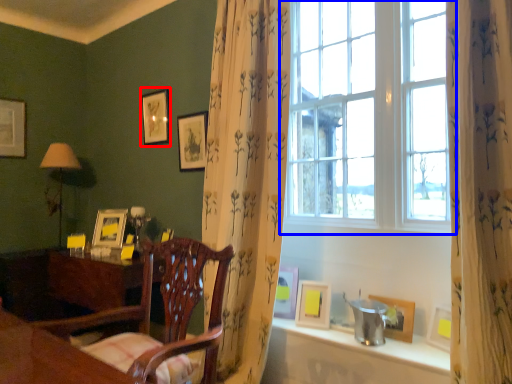
Question: Which object appears closest to the camera in this image, picture frame (highlighted by a red box) or window (highlighted by a blue box)?

Choices:
 (A) picture frame
 (B) window

Answer: (B)